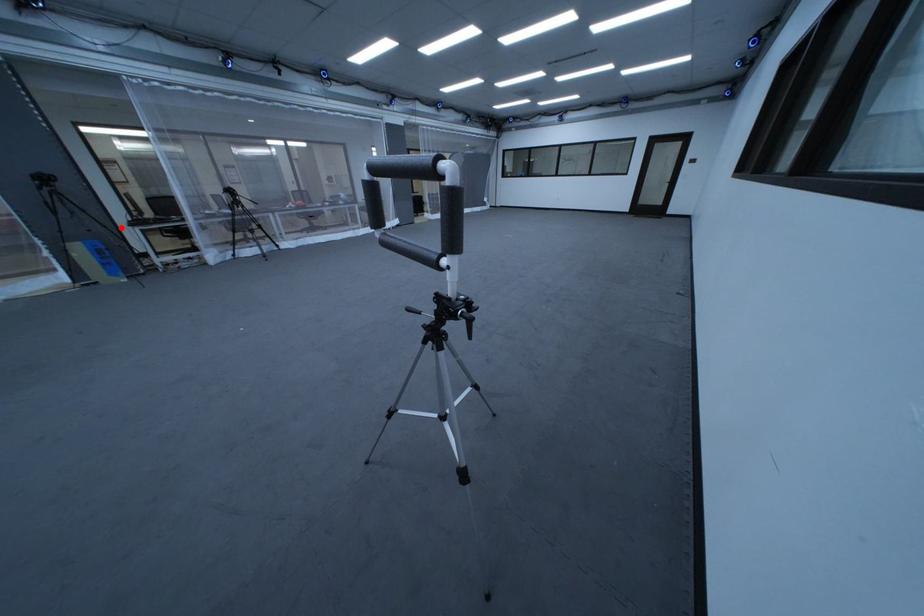
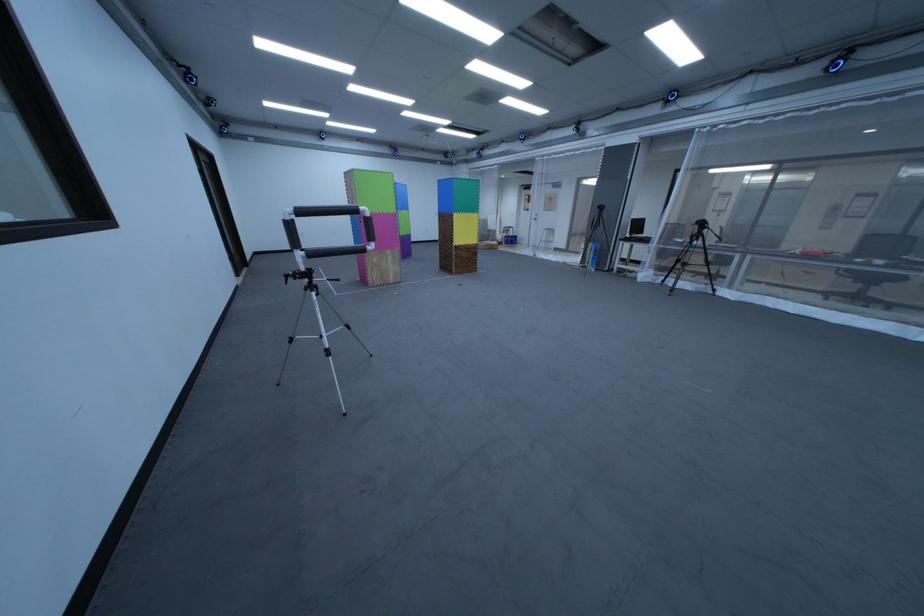
Question: I am providing you with two images of the same scene from different viewpoints. A red point is shown in image1. For the corresponding object point in image2, is it positioned nearer or farther from the camera?

Choices:
 (A) Nearer
 (B) Farther

Answer: (A)